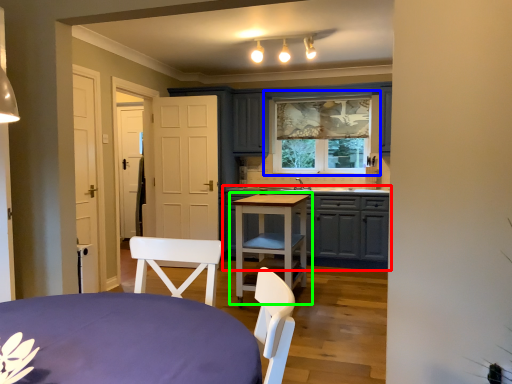
Question: Estimate the real-world distances between objects in this image. Which object is farther from cabinetry (highlighted by a red box), window (highlighted by a blue box) or table (highlighted by a green box)?

Choices:
 (A) window
 (B) table

Answer: (A)